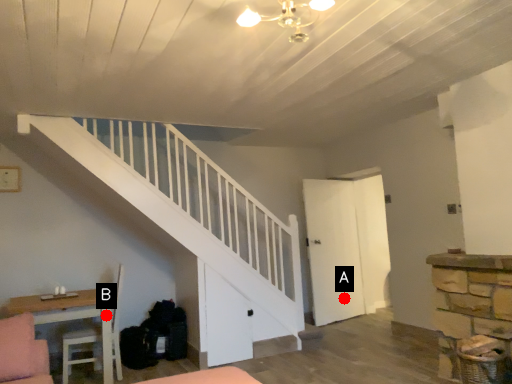
Question: Two points are circled on the image, labeled by A and B beside each circle. Which of the following is the farthest from the observer?

Choices:
 (A) A is further
 (B) B is further

Answer: (A)